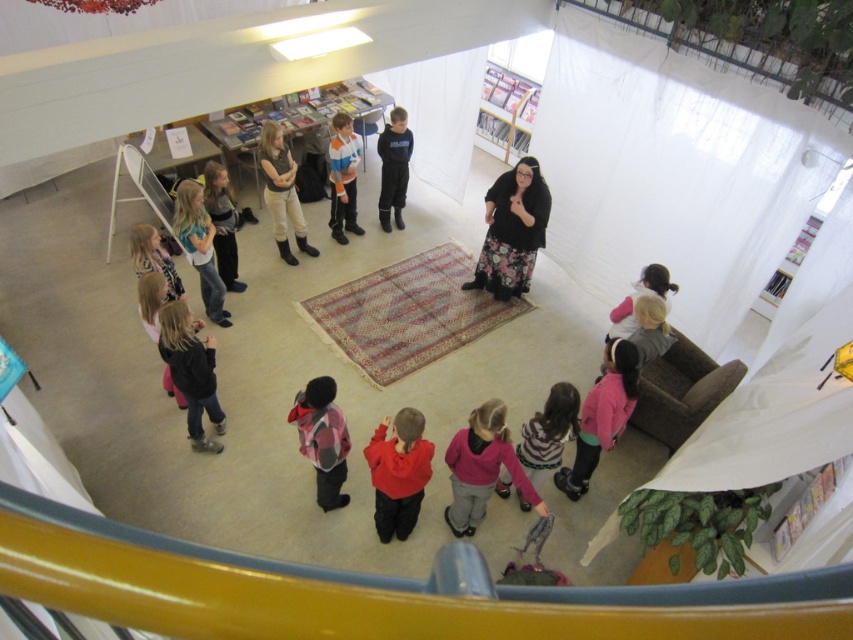
You are standing at the entrance of the library and want to find the striped sweater at center. According to the coordinates given, where should you look in the room?

The striped sweater at center is located at coordinates point [341,177] in the room.